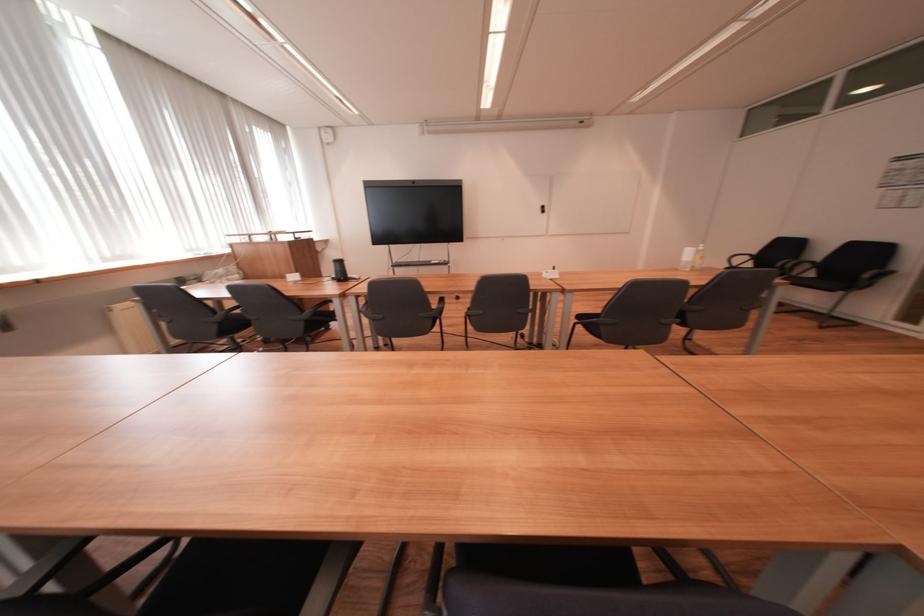
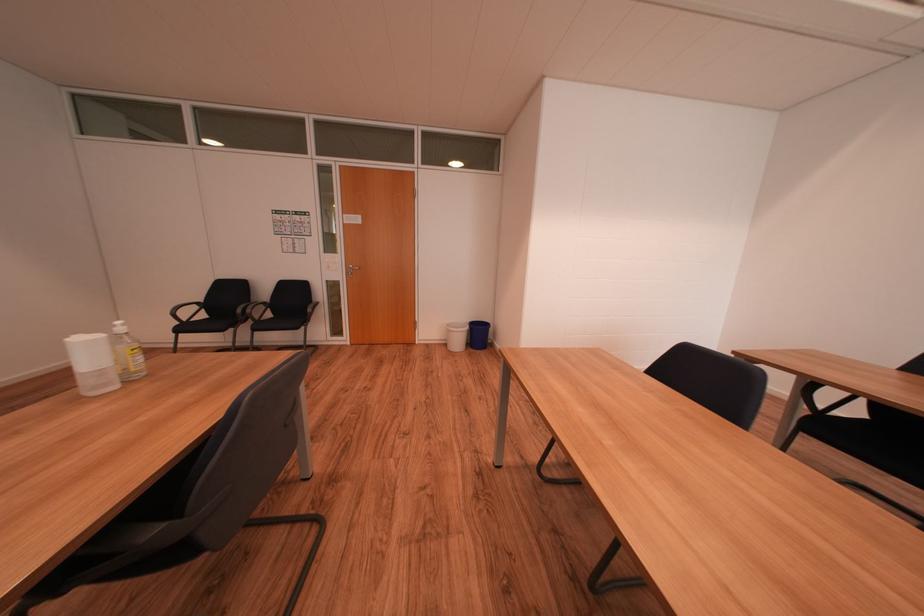
Where in the second image is the point corresponding to pixel 707 253 from the first image?

(126, 339)